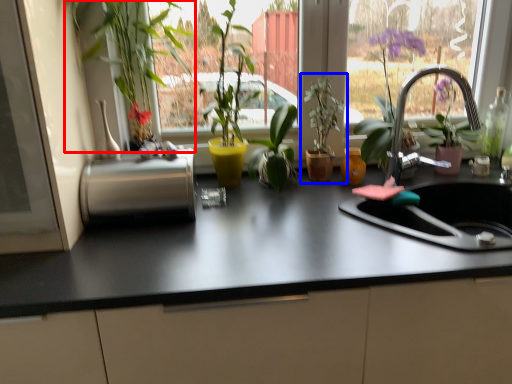
Question: Which object appears farthest to the camera in this image, houseplant (highlighted by a red box) or houseplant (highlighted by a blue box)?

Choices:
 (A) houseplant
 (B) houseplant

Answer: (B)